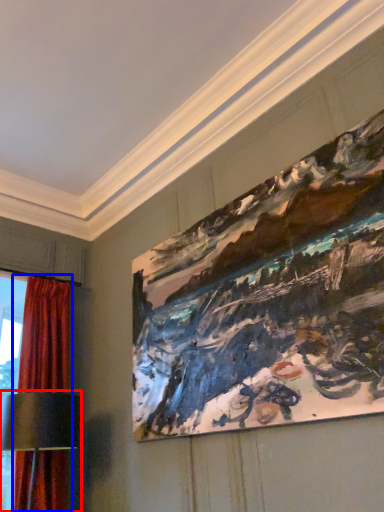
Question: Which object is closer to the camera taking this photo, table lamp (highlighted by a red box) or curtain (highlighted by a blue box)?

Choices:
 (A) table lamp
 (B) curtain

Answer: (A)